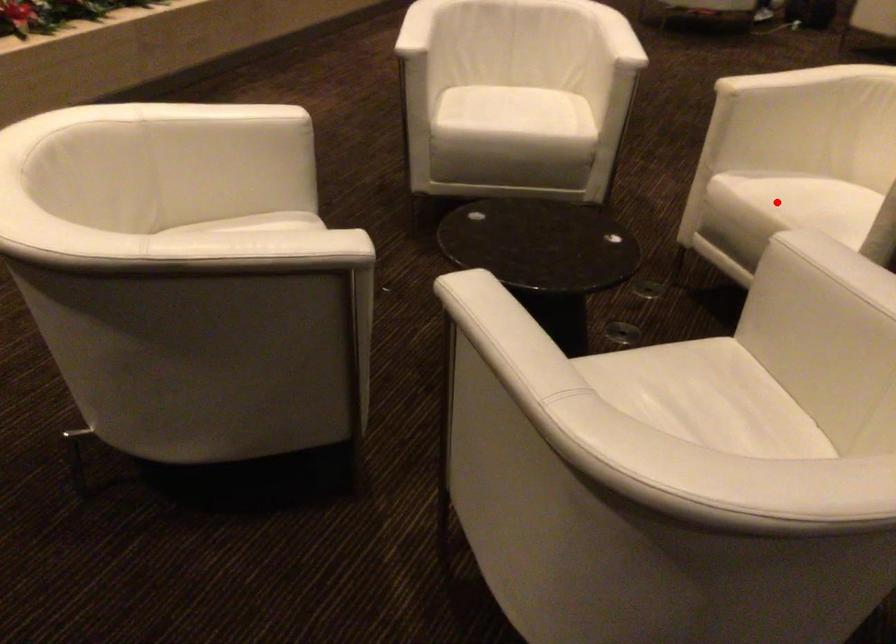
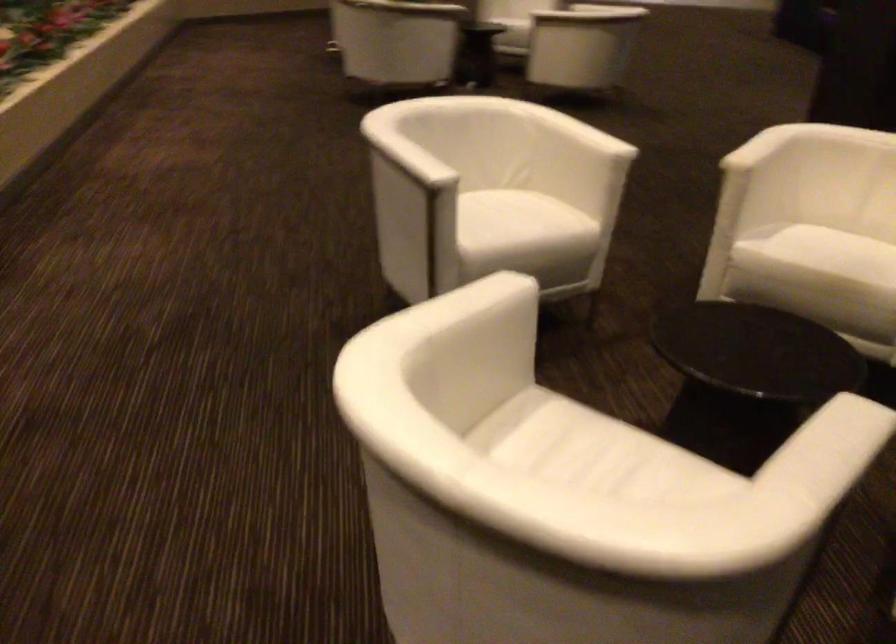
Question: I am providing you with two images of the same scene from different viewpoints. In image1, a red point is highlighted. Considering the same 3D point in image2, which of the following is correct?

Choices:
 (A) It is closer
 (B) It is farther

Answer: (B)